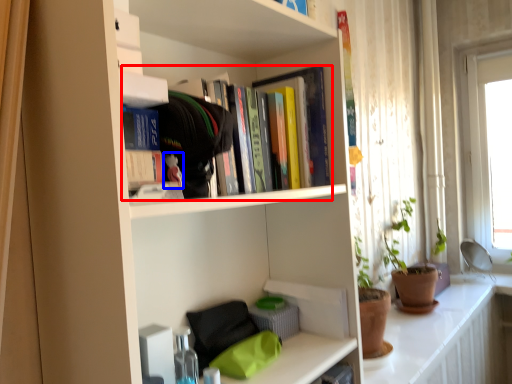
Question: Which of the following is the farthest to the observer, book (highlighted by a red box) or toy (highlighted by a blue box)?

Choices:
 (A) book
 (B) toy

Answer: (A)